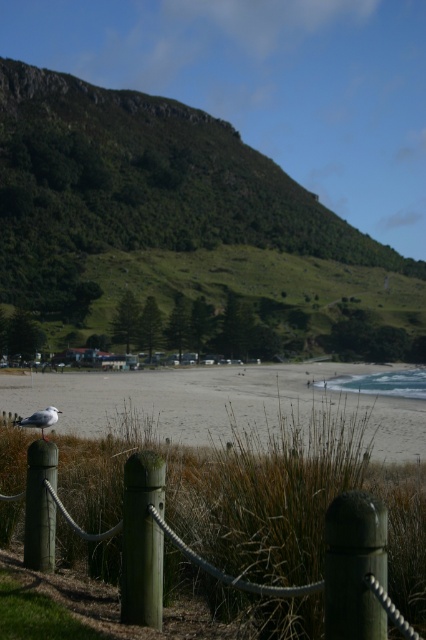
Who is lower down, green wood fence at lower center or white matte bird at center?

white matte bird at center

Is green wood fence at lower center in front of white matte bird at center?

Yes, green wood fence at lower center is in front of white matte bird at center.

You are a GUI agent. You are given a task and a screenshot of the screen. Output one action in this format:
    pyautogui.click(x=<x>, y=<y>)
    Task: Click on the green wood fence at lower center
    Image resolution: width=426 pixels, height=640 pixels.
    Given the screenshot: What is the action you would take?
    pyautogui.click(x=256, y=582)

Who is more distant from viewer, (385, 552) or (362, 604)?

Point (385, 552)

Which is below, green wood fence at lower center or green matte pole at center?

green wood fence at lower center is below.

Between point (155, 616) and point (354, 490), which one is positioned in front?

Point (354, 490) is in front.

Image resolution: width=426 pixels, height=640 pixels. In order to click on green wood fence at lower center in this screenshot , I will do `click(256, 582)`.

Is point (227, 378) positioned in front of point (43, 493)?

No, (227, 378) is behind (43, 493).

Who is shorter, beige sand at center or green matte post at lower left?

green matte post at lower left

Which is in front, point (147, 372) or point (37, 484)?

Point (37, 484) is more forward.

I want to click on beige sand at center, so click(218, 403).